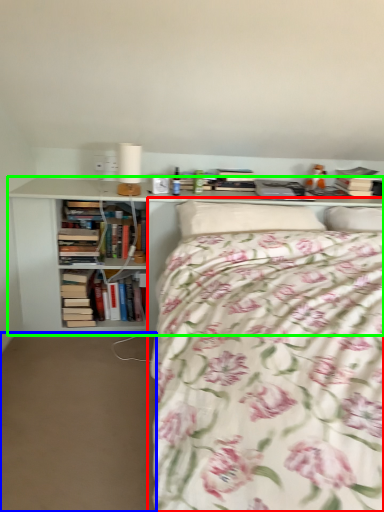
Question: Which object is positioned farthest from bed (highlighted by a red box)? Select from plain (highlighted by a blue box) and bookcase (highlighted by a green box).

Choices:
 (A) plain
 (B) bookcase

Answer: (A)